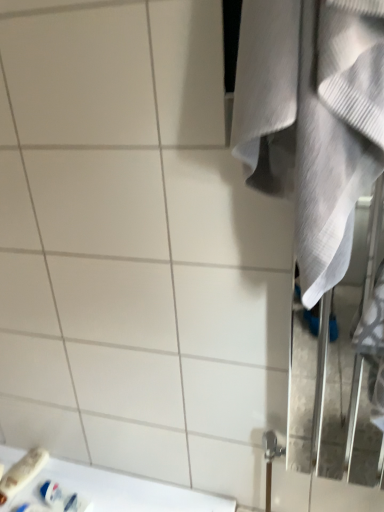
The image size is (384, 512). I want to click on white plastic toothbrush at lower left, which ranks as the first toiletry in left-to-right order, so click(22, 473).

The width and height of the screenshot is (384, 512). Describe the element at coordinates (22, 473) in the screenshot. I see `white plastic toothbrush at lower left, which ranks as the first toiletry in left-to-right order` at that location.

Identify the location of white plastic toothpaste tube at lower left, which is the 2th toiletry in left-to-right order. Image resolution: width=384 pixels, height=512 pixels. (63, 498).

From the image's perspective, which is below, white plastic toothbrush at lower left, the second toiletry positioned from the right, or white glossy counter top at lower left?

white glossy counter top at lower left, from the image's perspective.

From a real-world perspective, is white plastic toothbrush at lower left, which ranks as the first toiletry in left-to-right order, over white glossy counter top at lower left?

Yes, from a real-world perspective, white plastic toothbrush at lower left, which ranks as the first toiletry in left-to-right order, is on top of white glossy counter top at lower left.

Locate an element on the screen. The height and width of the screenshot is (512, 384). the 2nd toiletry above the white glossy counter top at lower left (from the image's perspective) is located at coordinates (22, 473).

Is white plastic toothbrush at lower left, the second toiletry positioned from the right, in front of or behind white glossy counter top at lower left in the image?

In the image, white plastic toothbrush at lower left, the second toiletry positioned from the right, appears behind white glossy counter top at lower left.

Could you measure the distance between white plastic toothbrush at lower left, the second toiletry positioned from the right, and white plastic toothpaste tube at lower left, which is the first toiletry in right-to-left order?

The distance of white plastic toothbrush at lower left, the second toiletry positioned from the right, from white plastic toothpaste tube at lower left, which is the first toiletry in right-to-left order, is 4.70 inches.

From the image's perspective, is white plastic toothbrush at lower left, which ranks as the first toiletry in left-to-right order, positioned above or below white plastic toothpaste tube at lower left, which is the first toiletry in right-to-left order?

white plastic toothbrush at lower left, which ranks as the first toiletry in left-to-right order, is above white plastic toothpaste tube at lower left, which is the first toiletry in right-to-left order.

Is white plastic toothbrush at lower left, the second toiletry positioned from the right, outside of white plastic toothpaste tube at lower left, which is the first toiletry in right-to-left order?

That's correct, white plastic toothbrush at lower left, the second toiletry positioned from the right, is outside of white plastic toothpaste tube at lower left, which is the first toiletry in right-to-left order.

Which object is wider, white plastic toothbrush at lower left, which ranks as the first toiletry in left-to-right order, or white plastic toothpaste tube at lower left, which is the 2th toiletry in left-to-right order?

With larger width is white plastic toothbrush at lower left, which ranks as the first toiletry in left-to-right order.

Considering the sizes of objects white glossy counter top at lower left and white plastic toothpaste tube at lower left, which is the first toiletry in right-to-left order, in the image provided, who is wider, white glossy counter top at lower left or white plastic toothpaste tube at lower left, which is the first toiletry in right-to-left order,?

white glossy counter top at lower left is wider.

From the white glossy counter top at lower left, count the 1st toiletry to the left and point to it. Please provide its 2D coordinates.

[(63, 498)]

Is white plastic toothpaste tube at lower left, which is the first toiletry in right-to-left order, surrounded by white glossy counter top at lower left?

Actually, white plastic toothpaste tube at lower left, which is the first toiletry in right-to-left order, is outside white glossy counter top at lower left.

Does white glossy counter top at lower left have a smaller size compared to white plastic toothpaste tube at lower left, which is the 2th toiletry in left-to-right order?

Actually, white glossy counter top at lower left might be larger than white plastic toothpaste tube at lower left, which is the 2th toiletry in left-to-right order.

Is the surface of white textured towel at right in direct contact with white plastic toothbrush at lower left, which ranks as the first toiletry in left-to-right order?

No, white textured towel at right is not beside white plastic toothbrush at lower left, which ranks as the first toiletry in left-to-right order.

From the picture: Considering the relative sizes of white textured towel at right and white plastic toothbrush at lower left, which ranks as the first toiletry in left-to-right order, in the image provided, is white textured towel at right wider than white plastic toothbrush at lower left, which ranks as the first toiletry in left-to-right order,?

No, white textured towel at right is not wider than white plastic toothbrush at lower left, which ranks as the first toiletry in left-to-right order.

Is white textured towel at right inside or outside of white plastic toothbrush at lower left, which ranks as the first toiletry in left-to-right order?

white textured towel at right is located beyond the bounds of white plastic toothbrush at lower left, which ranks as the first toiletry in left-to-right order.

Considering the relative sizes of white glossy counter top at lower left and white textured towel at right in the image provided, is white glossy counter top at lower left bigger than white textured towel at right?

Incorrect, white glossy counter top at lower left is not larger than white textured towel at right.

In the image, is white glossy counter top at lower left positioned in front of or behind white textured towel at right?

Visually, white glossy counter top at lower left is located behind white textured towel at right.

Would you say white textured towel at right is part of white glossy counter top at lower left's contents?

No, white textured towel at right is not a part of white glossy counter top at lower left.

From the image's perspective, is white glossy counter top at lower left positioned above or below white textured towel at right?

Clearly, from the image's perspective, white glossy counter top at lower left is below white textured towel at right.

What's the angular difference between white plastic toothpaste tube at lower left, which is the first toiletry in right-to-left order, and white textured towel at right's facing directions?

11.4 degrees.

From a real-world perspective, is white plastic toothpaste tube at lower left, which is the first toiletry in right-to-left order, over white textured towel at right?

No, from a real-world perspective, white plastic toothpaste tube at lower left, which is the first toiletry in right-to-left order, is not on top of white textured towel at right.

Which object is closer to the camera, white plastic toothpaste tube at lower left, which is the first toiletry in right-to-left order, or white textured towel at right?

Positioned in front is white textured towel at right.

How far apart are white plastic toothpaste tube at lower left, which is the first toiletry in right-to-left order, and white textured towel at right?

1.25 meters.

Find the location of a particular element. The height and width of the screenshot is (512, 384). towel on the right of white plastic toothpaste tube at lower left, which is the first toiletry in right-to-left order is located at coordinates (312, 119).

Is white textured towel at right situated inside white plastic toothpaste tube at lower left, which is the first toiletry in right-to-left order, or outside?

white textured towel at right is not inside white plastic toothpaste tube at lower left, which is the first toiletry in right-to-left order, it's outside.

Which object is further away from the camera, white textured towel at right or white plastic toothpaste tube at lower left, which is the 2th toiletry in left-to-right order?

white plastic toothpaste tube at lower left, which is the 2th toiletry in left-to-right order, is further from the camera.

Where is `the 1st toiletry positioned above the white glossy counter top at lower left (from a real-world perspective)`? The height and width of the screenshot is (512, 384). the 1st toiletry positioned above the white glossy counter top at lower left (from a real-world perspective) is located at coordinates (22, 473).

This screenshot has width=384, height=512. Identify the location of toiletry below the white plastic toothpaste tube at lower left, which is the first toiletry in right-to-left order (from a real-world perspective). (22, 473).

Which object lies further to the anchor point white plastic toothpaste tube at lower left, which is the 2th toiletry in left-to-right order, white textured towel at right or white glossy counter top at lower left?

white textured towel at right.

Estimate the real-world distances between objects in this image. Which object is further from white plastic toothbrush at lower left, which ranks as the first toiletry in left-to-right order, white textured towel at right or white plastic toothpaste tube at lower left, which is the 2th toiletry in left-to-right order?

Among the two, white textured towel at right is located further to white plastic toothbrush at lower left, which ranks as the first toiletry in left-to-right order.

Estimate the real-world distances between objects in this image. Which object is closer to white glossy counter top at lower left, white textured towel at right or white plastic toothpaste tube at lower left, which is the 2th toiletry in left-to-right order?

white plastic toothpaste tube at lower left, which is the 2th toiletry in left-to-right order, is closer to white glossy counter top at lower left.

Based on their spatial positions, is white plastic toothbrush at lower left, the second toiletry positioned from the right, or white glossy counter top at lower left further from white plastic toothpaste tube at lower left, which is the 2th toiletry in left-to-right order?

white plastic toothbrush at lower left, the second toiletry positioned from the right, is positioned further to the anchor white plastic toothpaste tube at lower left, which is the 2th toiletry in left-to-right order.

When comparing their distances from white textured towel at right, does white plastic toothbrush at lower left, the second toiletry positioned from the right, or white glossy counter top at lower left seem further?

white plastic toothbrush at lower left, the second toiletry positioned from the right, is further to white textured towel at right.

From the image, which object appears to be nearer to white glossy counter top at lower left, white plastic toothbrush at lower left, which ranks as the first toiletry in left-to-right order, or white textured towel at right?

white plastic toothbrush at lower left, which ranks as the first toiletry in left-to-right order, lies closer to white glossy counter top at lower left than the other object.

Based on their spatial positions, is white glossy counter top at lower left or white plastic toothbrush at lower left, which ranks as the first toiletry in left-to-right order, closer to white textured towel at right?

The object closer to white textured towel at right is white glossy counter top at lower left.

Based on their spatial positions, is white glossy counter top at lower left or white plastic toothbrush at lower left, which ranks as the first toiletry in left-to-right order, closer to white plastic toothpaste tube at lower left, which is the first toiletry in right-to-left order?

white glossy counter top at lower left is closer to white plastic toothpaste tube at lower left, which is the first toiletry in right-to-left order.

This screenshot has height=512, width=384. I want to click on toiletry between white plastic toothbrush at lower left, which ranks as the first toiletry in left-to-right order, and white glossy counter top at lower left from left to right, so click(63, 498).

At what (x,y) coordinates should I click in order to perform the action: click on toiletry between white textured towel at right and white plastic toothpaste tube at lower left, which is the 2th toiletry in left-to-right order, vertically. Please return your answer as a coordinate pair (x, y). Image resolution: width=384 pixels, height=512 pixels. Looking at the image, I should click on (22, 473).